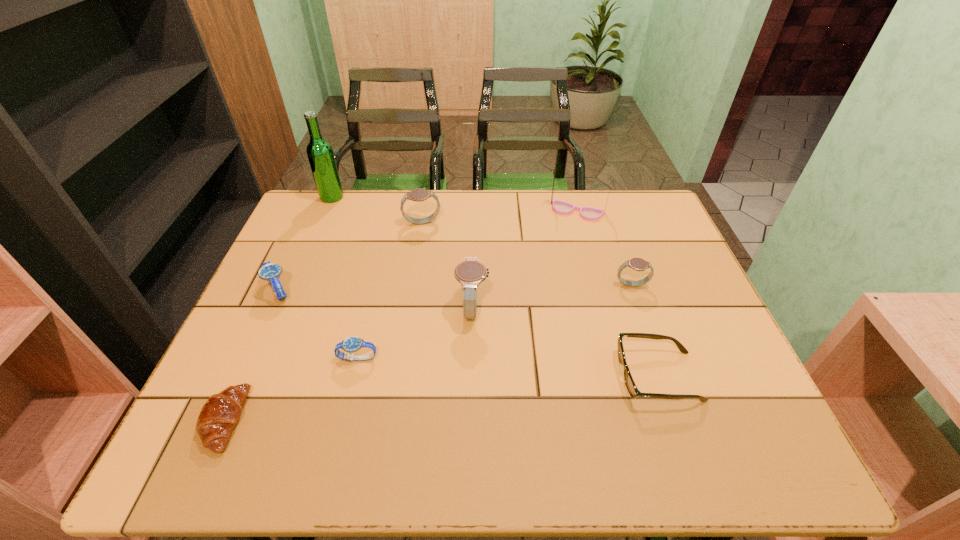
You are a GUI agent. You are given a task and a screenshot of the screen. Output one action in this format:
    pyautogui.click(x=<x>, y=<y>)
    Task: Click on the vacant space at the left edge of the desktop
    
    Given the screenshot: What is the action you would take?
    pyautogui.click(x=261, y=360)

Identify the location of free region at the right edge. Image resolution: width=960 pixels, height=540 pixels. (696, 325).

In the image, there is a desktop. Where is `free space at the far left corner`? free space at the far left corner is located at coordinates (324, 227).

I want to click on vacant space that is in between the shorter spectacles and the shortest watch, so click(x=508, y=367).

Find the location of a particular element. vacant region between the rightmost gray watch and the tallest object is located at coordinates (482, 241).

Image resolution: width=960 pixels, height=540 pixels. Identify the location of blank region between the second gray watch from left to right and the crescent roll. (348, 364).

I want to click on empty location between the green beer bottle and the leftmost watch, so click(305, 244).

The width and height of the screenshot is (960, 540). What are the coordinates of `free space between the farthest gray watch and the bigger blue watch` in the screenshot? It's located at (350, 256).

Where is `empty space between the tallest object and the fourth tallest object`? empty space between the tallest object and the fourth tallest object is located at coordinates (377, 210).

The image size is (960, 540). Identify the location of vacant point located between the smallest gray watch and the right blue watch. (494, 322).